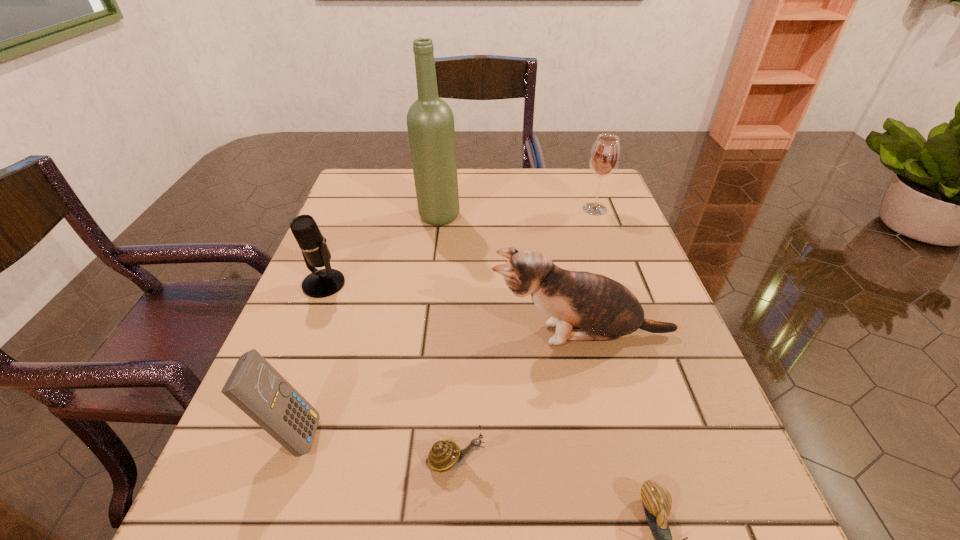
At what (x,y) coordinates should I click in order to perform the action: click on vacant point located 0.380m at the face of the fourth farthest object. Please return your answer as a coordinate pair (x, y). The image size is (960, 540). Looking at the image, I should click on (284, 335).

Where is `vacant area situated at the face of the fourth farthest object`? Image resolution: width=960 pixels, height=540 pixels. vacant area situated at the face of the fourth farthest object is located at coordinates (420, 335).

The image size is (960, 540). Identify the location of vacant space located 0.140m on the right of the microphone. (412, 284).

Image resolution: width=960 pixels, height=540 pixels. Identify the location of free spot located 0.110m on the front-facing side of the calculator. (395, 434).

Find the location of `vacant region located on the face of the farther escargot`. vacant region located on the face of the farther escargot is located at coordinates (616, 461).

Find the location of a particular element. This screenshot has width=960, height=540. wine bottle present at the far edge is located at coordinates (430, 121).

At what (x,y) coordinates should I click in order to perform the action: click on wineglass that is at the far edge. Please return your answer as a coordinate pair (x, y). This screenshot has width=960, height=540. Looking at the image, I should click on (605, 154).

Find the location of a particular element. microphone that is at the left edge is located at coordinates (321, 283).

Where is `calculator that is at the left edge`? The height and width of the screenshot is (540, 960). calculator that is at the left edge is located at coordinates (255, 386).

You are a GUI agent. You are given a task and a screenshot of the screen. Output one action in this format:
    pyautogui.click(x=<x>, y=<y>)
    Task: Click on the wineglass at the right edge
    Image resolution: width=960 pixels, height=540 pixels.
    Given the screenshot: What is the action you would take?
    pyautogui.click(x=605, y=154)